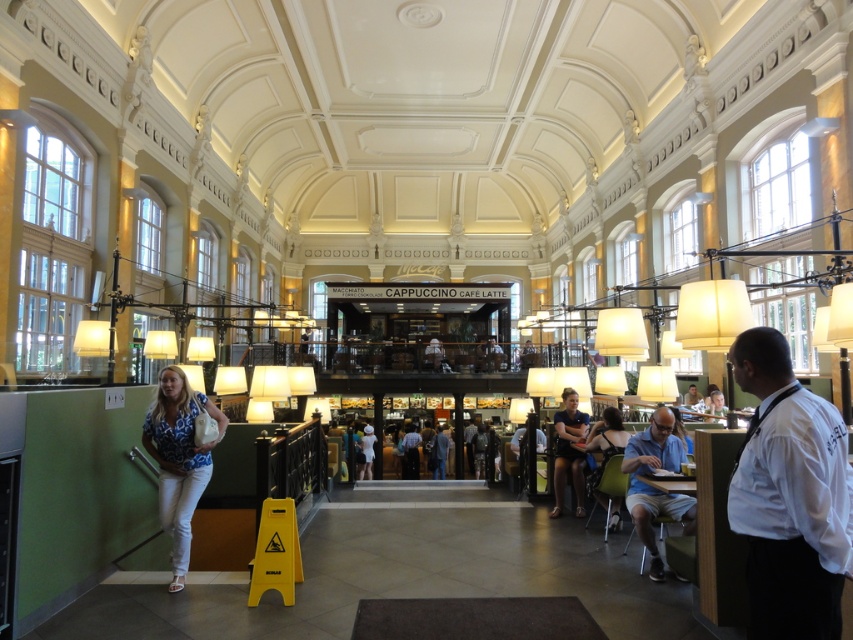
You are a customer in the cafe and want to choose a shirt to wear. The white shirt at right is on a hanger, and the dark blue shirt at center is folded on a table. Which shirt has a narrower width when laid flat?

The white shirt at right is thinner than the dark blue shirt at center, so the white shirt at right has a narrower width when laid flat.

You are a customer standing at the entrance of the cafe and see the white shirt at right and the blue printed blouse at lower left. Which clothing item is closer to you?

The blue printed blouse at lower left is closer to you since it is located at lower left, which is typically nearer to the entrance compared to the white shirt at right positioned further away.